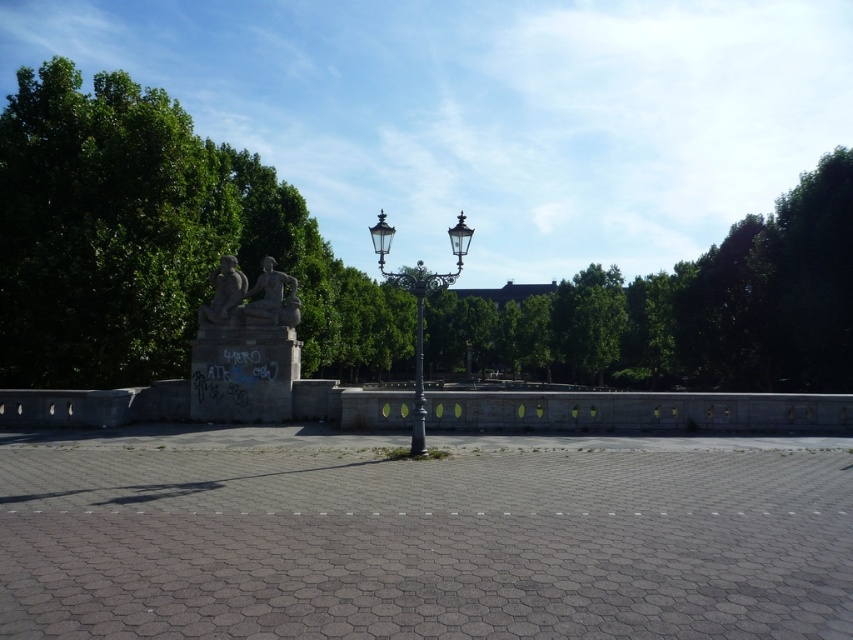
You are a painter setting up an easel to capture the scene. You want to ensure that both the green leafy tree at center and the polished brass lamp post at center are visible in your painting. Which object will have a larger silhouette in your painting?

The green leafy tree at center is taller than the polished brass lamp post at center, so it will have a larger silhouette in the painting.

You are standing at the center of the paved area and want to walk to the point that is closer to the stone pedestal with two sculpted figures. Which coordinate should you head towards, point (422, 380) or point (219, 300)?

Point (219, 300) is closer to the stone pedestal with two sculpted figures because it is located behind point (422, 380), which is in front of it. Since the pedestal is at the center, the point behind it would be closer.

You are a city planner assessing the space between the green leafy tree at center and the polished brass lamp post at center. If you want to install a bench that requires 3 meters of space, will there be enough room based on their widths?

The green leafy tree at center is wider than the polished brass lamp post at center. However, the question asks about the space between them, not their widths. The provided information does not specify the distance between the two objects, only their relative widths. Therefore, it is impossible to determine if there is enough space for the bench based on the given data.